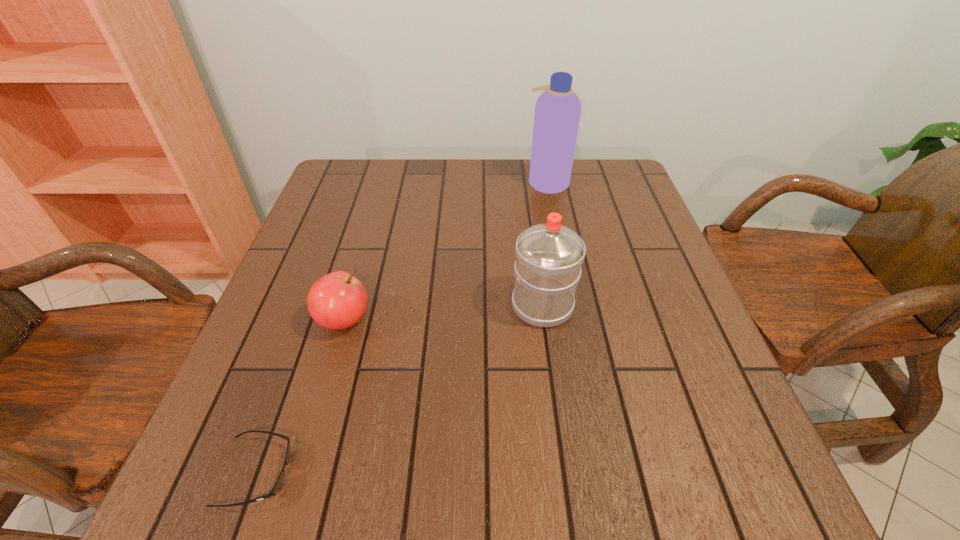
Locate an element on the screen. The image size is (960, 540). blank area located on the front of the third tallest object is located at coordinates (303, 460).

The image size is (960, 540). What are the coordinates of `free space located 0.250m on the front-facing side of the nearest object` in the screenshot? It's located at (453, 472).

Identify the location of object at the far edge. (557, 111).

I want to click on object at the near edge, so click(279, 481).

This screenshot has width=960, height=540. Find the location of `apple located in the left edge section of the desktop`. apple located in the left edge section of the desktop is located at coordinates (338, 300).

This screenshot has width=960, height=540. I want to click on sunglasses present at the left edge, so click(x=279, y=481).

The height and width of the screenshot is (540, 960). I want to click on object located in the near left corner section of the desktop, so click(x=279, y=481).

You are a GUI agent. You are given a task and a screenshot of the screen. Output one action in this format:
    pyautogui.click(x=<x>, y=<y>)
    Task: Click on the free space at the far edge
    Image resolution: width=960 pixels, height=540 pixels.
    Given the screenshot: What is the action you would take?
    pyautogui.click(x=482, y=181)

In the image, there is a desktop. Where is `free space at the near edge`? free space at the near edge is located at coordinates (581, 465).

Where is `vacant region at the left edge of the desktop`? vacant region at the left edge of the desktop is located at coordinates (243, 389).